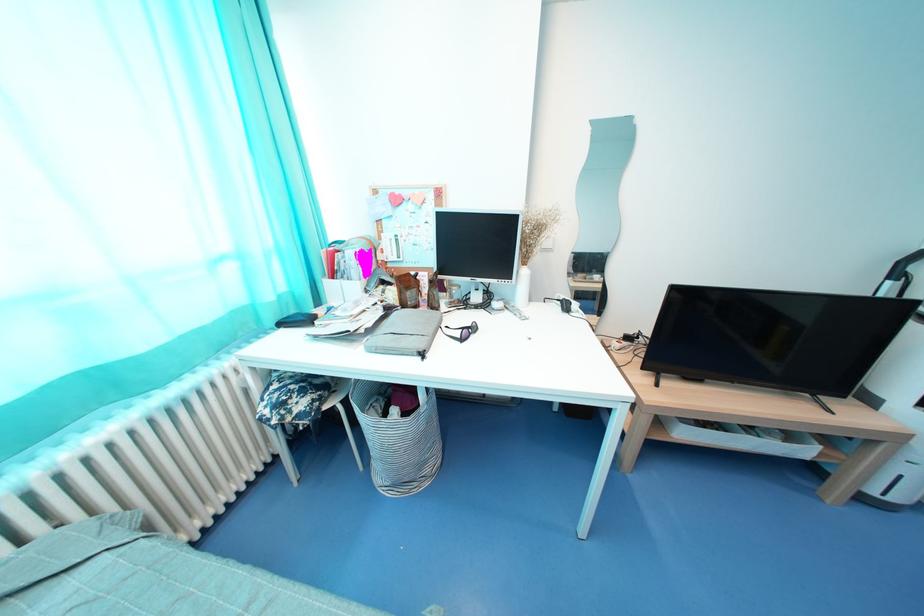
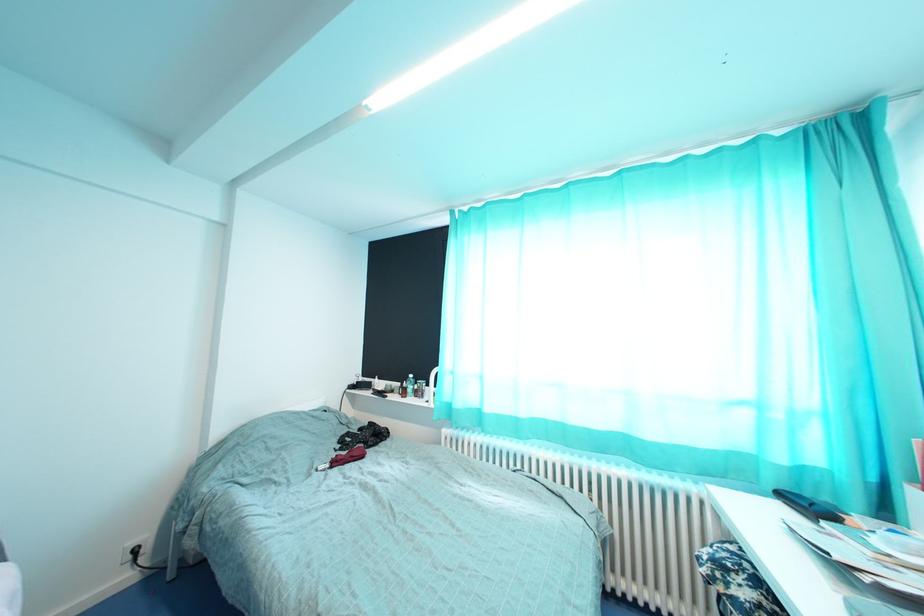
Question: Based on the continuous images, in which direction is the camera rotating? Reply with the corresponding letter.

Choices:
 (A) Left
 (B) Right
 (C) Up
 (D) Down

Answer: (A)